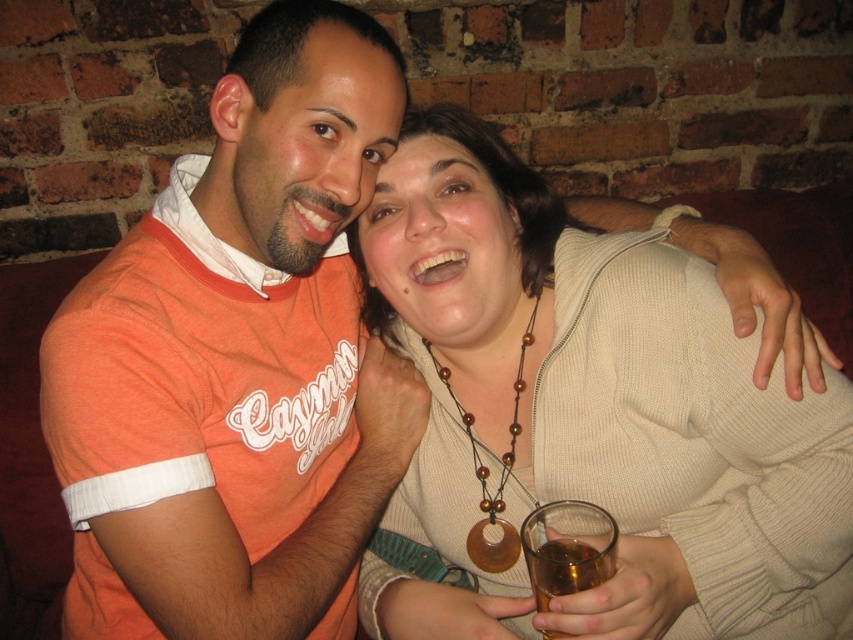
Which is behind, point (502, 420) or point (573, 580)?

The point (502, 420) is more distant.

Which is behind, point (769, 538) or point (527, 560)?

The point (769, 538) is more distant.

Where is `knitted beige sweater at center`? The height and width of the screenshot is (640, 853). knitted beige sweater at center is located at coordinates (589, 417).

Describe the element at coordinates (589, 417) in the screenshot. This screenshot has width=853, height=640. I see `knitted beige sweater at center` at that location.

Who is shorter, knitted beige sweater at center or orange cotton t-shirt at left?

With less height is knitted beige sweater at center.

Find the location of a particular element. This screenshot has height=640, width=853. knitted beige sweater at center is located at coordinates (589, 417).

Who is higher up, orange cotton t-shirt at left or amber liquid glass at lower center?

orange cotton t-shirt at left is above.

Is orange cotton t-shirt at left positioned in front of amber liquid glass at lower center?

That is False.

Find the location of `orange cotton t-shirt at left`. orange cotton t-shirt at left is located at coordinates (238, 360).